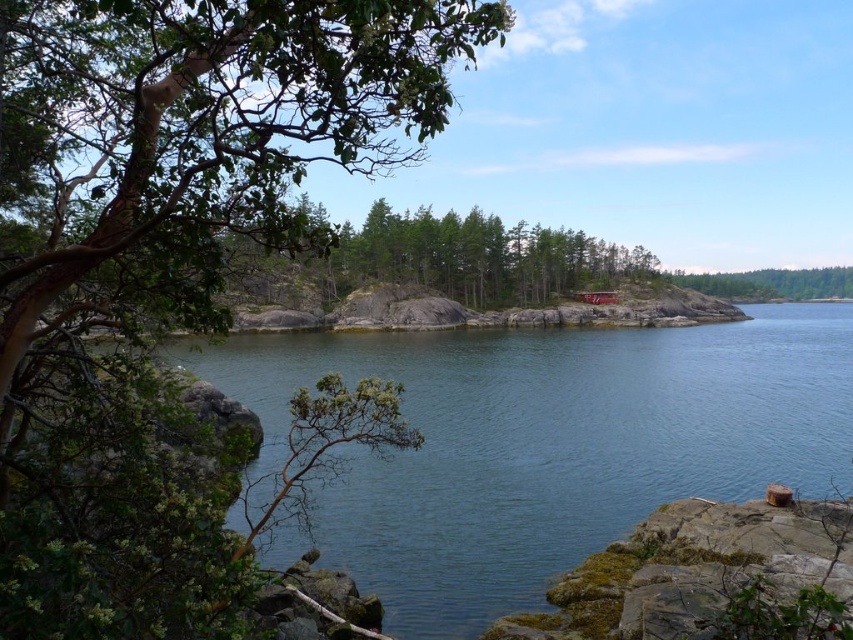
From the picture: You are standing at the lakeside and looking at the two points marked in the image. Which point, point (260, 164) or point (363, 513), is closer to you?

Point (260, 164) is closer to you than point (363, 513).

You are standing at the point marked as point (164, 257). Which object is directly in front of you?

The green leafy tree at left is located at point (164, 257), so it is directly in front of you.

Based on the photo, you are standing on the rocky outcrop in the foreground and want to reach the green leafy tree at right. Which direction should you walk to get there without crossing the clear water at center?

You should walk around the clear water at center to the right side to reach the green leafy tree at right since the clear water at center is positioned under the green leafy tree at right.